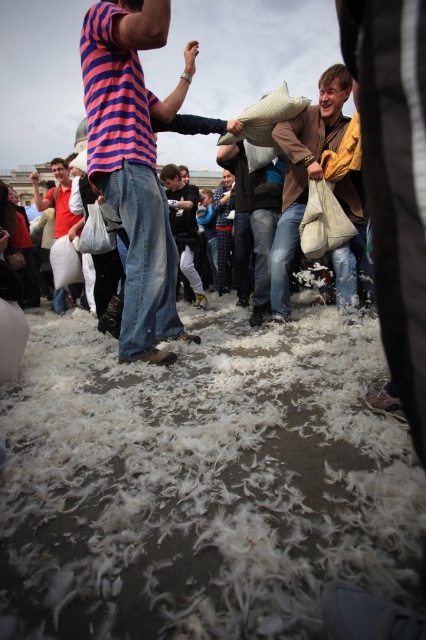
You are organizing a photo shoot and need to place two props, the brown leather jacket at upper center and the matte red shirt at left, in a way that maintains their original spatial relationship. Which prop should be placed closer to the camera to ensure they appear proportionally accurate?

The brown leather jacket at upper center should be placed closer to the camera since it has a lesser width compared to the matte red shirt at left, ensuring they appear proportionally accurate.

You are a photographer at the pillow fight event. You want to capture a photo where both the brown leather jacket at upper center and the matte red shirt at left are visible. Which object should be placed closer to the bottom of the photo frame to ensure both are in view?

The brown leather jacket at upper center should be placed closer to the bottom of the photo frame because it is shorter than the matte red shirt at left, allowing both to fit within the frame.